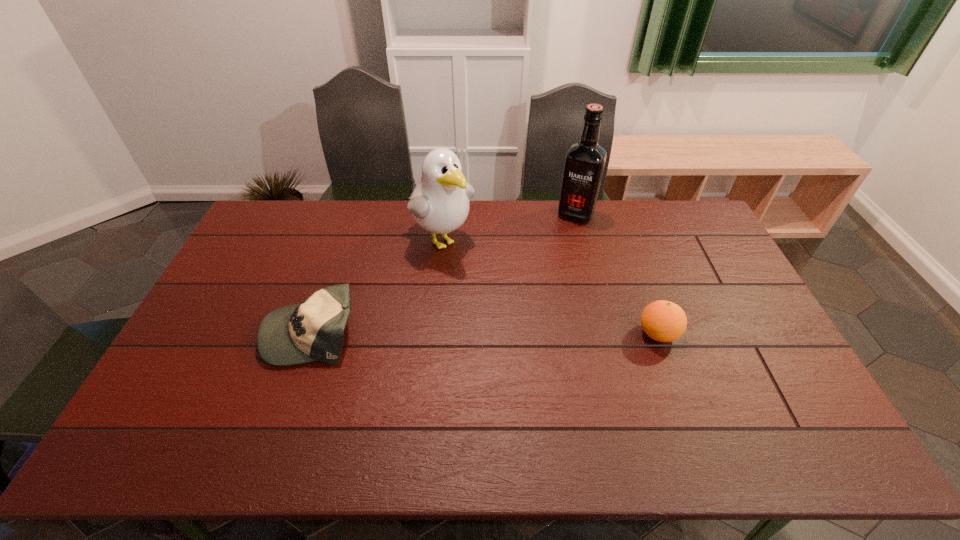
Where is `vacant space located on the front-facing side of the second object from right to left`? This screenshot has width=960, height=540. vacant space located on the front-facing side of the second object from right to left is located at coordinates (555, 260).

Where is `free spot located 0.330m on the front-facing side of the second object from right to left`? free spot located 0.330m on the front-facing side of the second object from right to left is located at coordinates (545, 283).

In order to click on free space located 0.090m on the beak of the third object from right to left in this screenshot , I will do `click(475, 273)`.

You are a GUI agent. You are given a task and a screenshot of the screen. Output one action in this format:
    pyautogui.click(x=<x>, y=<y>)
    Task: Click on the vacant space located 0.060m on the beak of the third object from right to left
    This screenshot has width=960, height=540.
    Given the screenshot: What is the action you would take?
    pyautogui.click(x=470, y=267)

Identify the location of free region located on the beak of the third object from right to left. (492, 289).

At what (x,y) coordinates should I click in order to perform the action: click on liquor present at the far edge. Please return your answer as a coordinate pair (x, y). The height and width of the screenshot is (540, 960). Looking at the image, I should click on (584, 164).

Identify the location of gull that is positioned at the far edge. (439, 203).

This screenshot has height=540, width=960. What are the coordinates of `vacant space at the far edge of the desktop` in the screenshot? It's located at (309, 217).

You are a GUI agent. You are given a task and a screenshot of the screen. Output one action in this format:
    pyautogui.click(x=<x>, y=<y>)
    Task: Click on the free space at the near edge
    This screenshot has width=960, height=540.
    Given the screenshot: What is the action you would take?
    pyautogui.click(x=723, y=413)

The height and width of the screenshot is (540, 960). I want to click on free space at the left edge, so click(x=209, y=355).